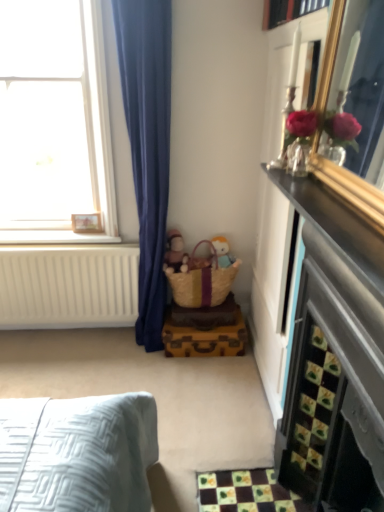
Where is `free point above white painted wood at left (from a real-world perspective)`? free point above white painted wood at left (from a real-world perspective) is located at coordinates (54, 236).